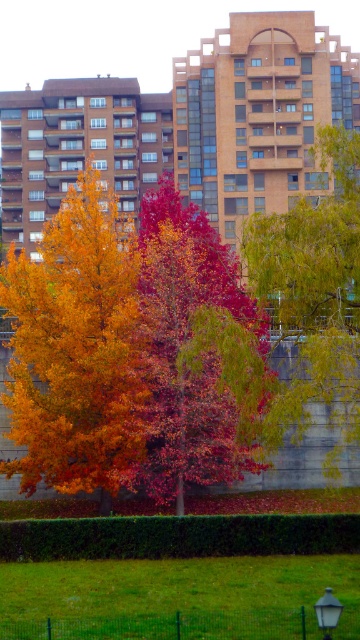
Question: Can you confirm if autumn leaves at center is positioned to the right of yellow-green leafy tree at center?

Choices:
 (A) yes
 (B) no

Answer: (B)

Question: Does autumn leaves at center come in front of yellow-green leafy tree at center?

Choices:
 (A) no
 (B) yes

Answer: (A)

Question: Is autumn leaves at center wider than yellow-green leafy tree at center?

Choices:
 (A) no
 (B) yes

Answer: (B)

Question: Which point is farther to the camera?

Choices:
 (A) yellow-green leafy tree at center
 (B) autumn leaves at center

Answer: (B)

Question: Which of the following is the farthest from the observer?

Choices:
 (A) (336, 419)
 (B) (222, 291)

Answer: (B)

Question: Which point is closer to the camera taking this photo?

Choices:
 (A) (299, 378)
 (B) (195, 445)

Answer: (A)